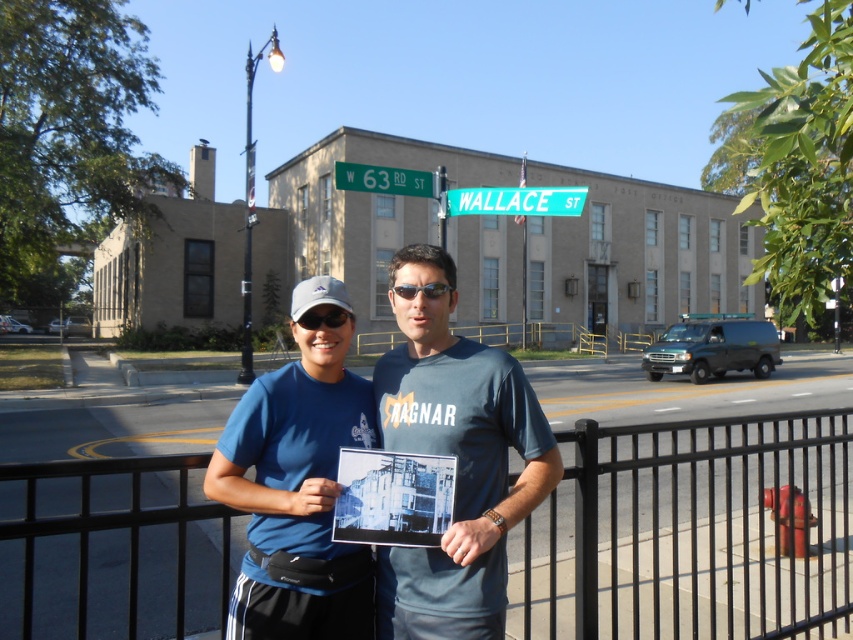
Question: Is black metal fence at lower center below green plastic street sign at upper center?

Choices:
 (A) no
 (B) yes

Answer: (B)

Question: Estimate the real-world distances between objects in this image. Which object is farther from the green plastic street sign at upper center?

Choices:
 (A) black metal fence at lower center
 (B) sunglasses at center
 (C) blue fabric shirt at center
 (D) black plastic goggles at center

Answer: (C)

Question: Which point appears farthest from the camera in this image?

Choices:
 (A) (693, 465)
 (B) (341, 308)

Answer: (A)

Question: Does green plastic street sign at upper center have a smaller size compared to green metallic street sign at upper center?

Choices:
 (A) no
 (B) yes

Answer: (A)

Question: Which object appears closest to the camera in this image?

Choices:
 (A) blue fabric shirt at center
 (B) green plastic street sign at upper center

Answer: (A)

Question: Can you confirm if dark blue t-shirt at center is smaller than green plastic street sign at upper center?

Choices:
 (A) yes
 (B) no

Answer: (A)